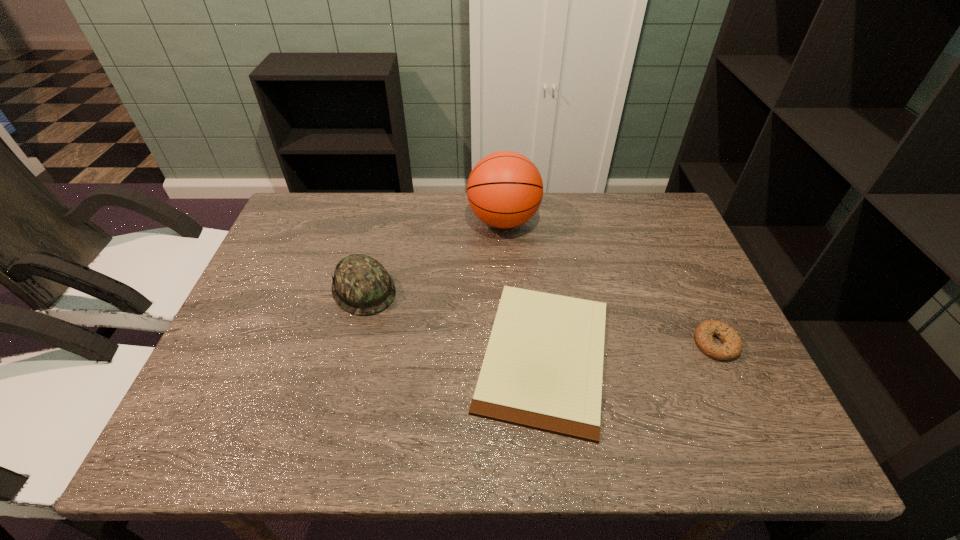
At what (x,y) coordinates should I click in order to perform the action: click on blank area at the near right corner. Please return your answer as a coordinate pair (x, y). Image resolution: width=960 pixels, height=540 pixels. Looking at the image, I should click on point(732,449).

Where is `vacant area between the clipboard and the second tallest object`? Image resolution: width=960 pixels, height=540 pixels. vacant area between the clipboard and the second tallest object is located at coordinates (454, 322).

The height and width of the screenshot is (540, 960). Find the location of `empty space between the clipboard and the third tallest object`. empty space between the clipboard and the third tallest object is located at coordinates (630, 349).

Locate an element on the screen. The width and height of the screenshot is (960, 540). vacant area between the clipboard and the farthest object is located at coordinates (524, 288).

Identify the location of free point between the shortest object and the tallest object. The image size is (960, 540). (524, 288).

What are the coordinates of `vacant area that lies between the headwear and the clipboard` in the screenshot? It's located at (454, 322).

Locate an element on the screen. vacant space that's between the headwear and the basketball is located at coordinates pos(434,255).

Locate an element on the screen. Image resolution: width=960 pixels, height=540 pixels. blank region between the shortest object and the third shortest object is located at coordinates (454, 322).

Locate an element on the screen. The image size is (960, 540). object that ranks as the second closest to the third shortest object is located at coordinates (505, 189).

The image size is (960, 540). Identify the location of the third closest object to the farthest object. (732, 346).